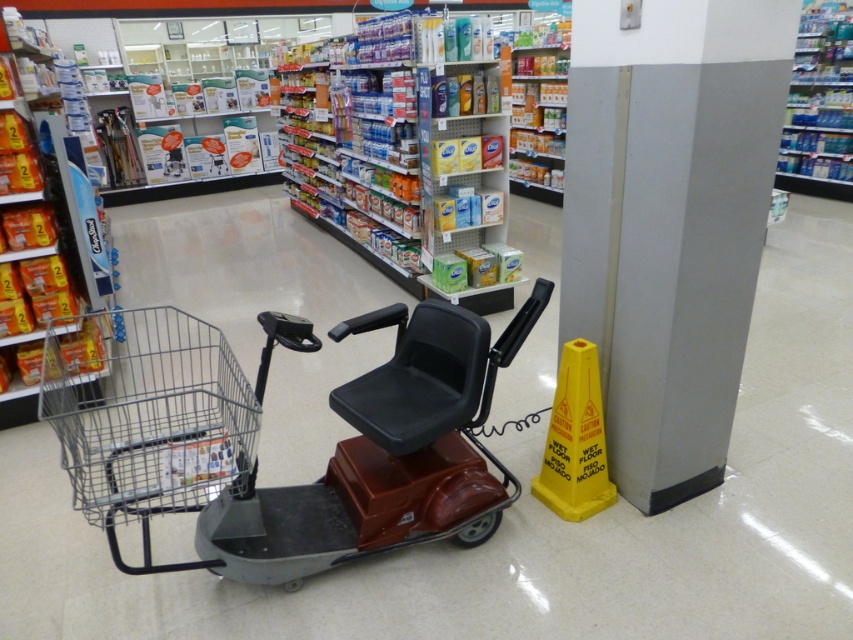
Does point (593, 268) come closer to viewer compared to point (454, 429)?

No, it is behind (454, 429).

Does gray smooth pillar at right have a larger size compared to metallic gray shopping cart at center?

Incorrect, gray smooth pillar at right is not larger than metallic gray shopping cart at center.

Is point (637, 369) in front of point (221, 556)?

No.

You are a GUI agent. You are given a task and a screenshot of the screen. Output one action in this format:
    pyautogui.click(x=<x>, y=<y>)
    Task: Click on the gray smooth pillar at right
    This screenshot has height=640, width=853.
    Given the screenshot: What is the action you would take?
    (669, 221)